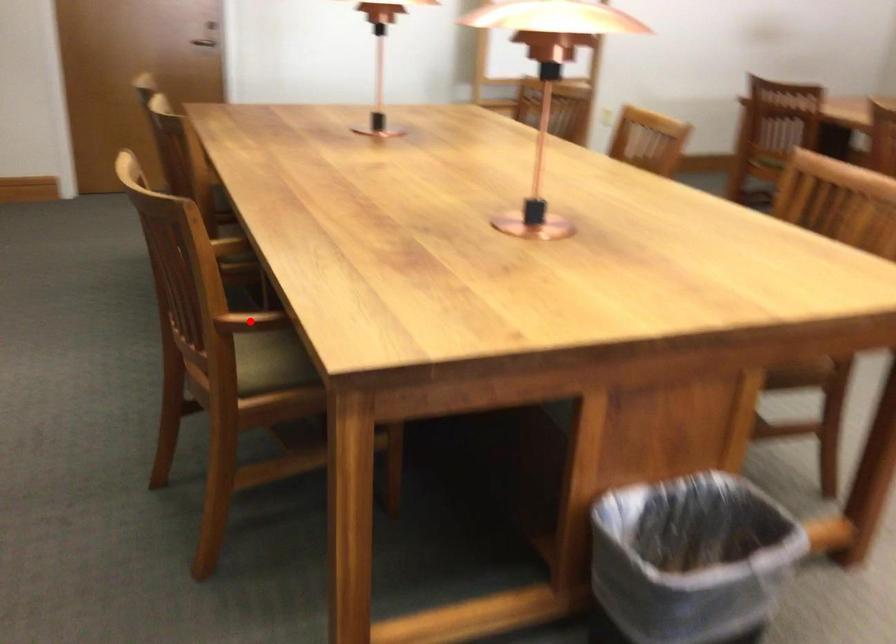
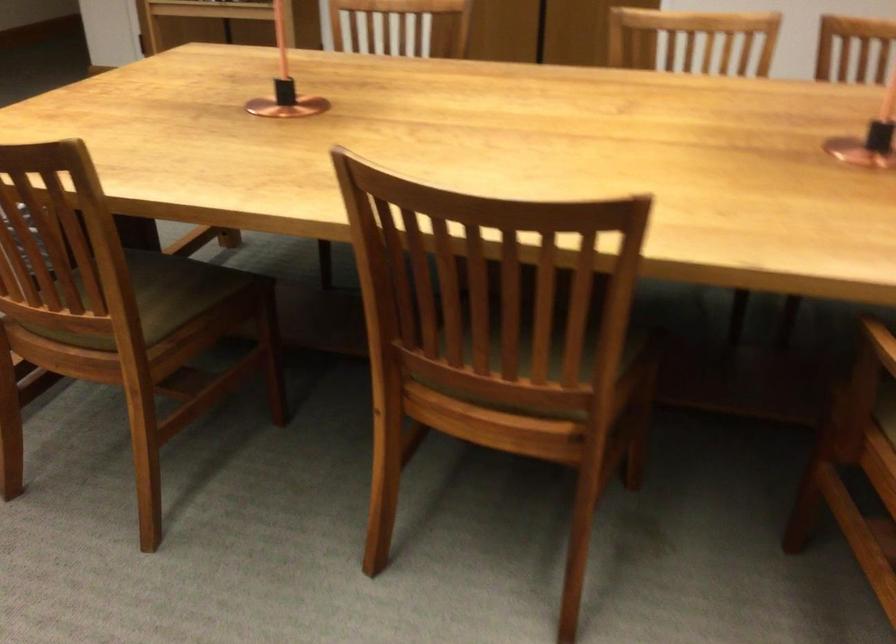
Question: I am providing you with two images of the same scene from different viewpoints. A red point is marked on the first image. Can you still see the location of the red point in image 2?

Choices:
 (A) Yes
 (B) No

Answer: (B)